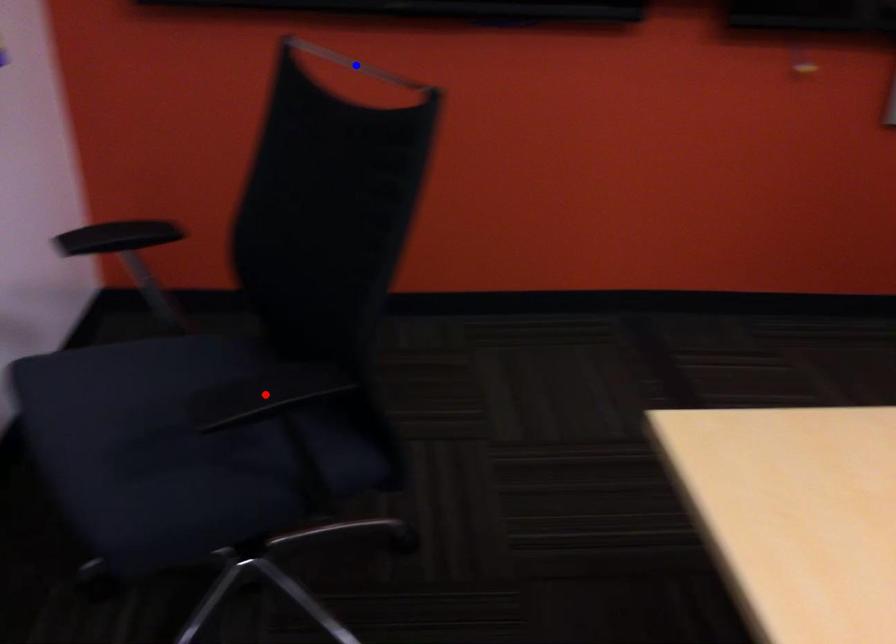
Question: Two points are marked on the image. Which point is closer to the camera?

Choices:
 (A) Blue point is closer.
 (B) Red point is closer.

Answer: (B)